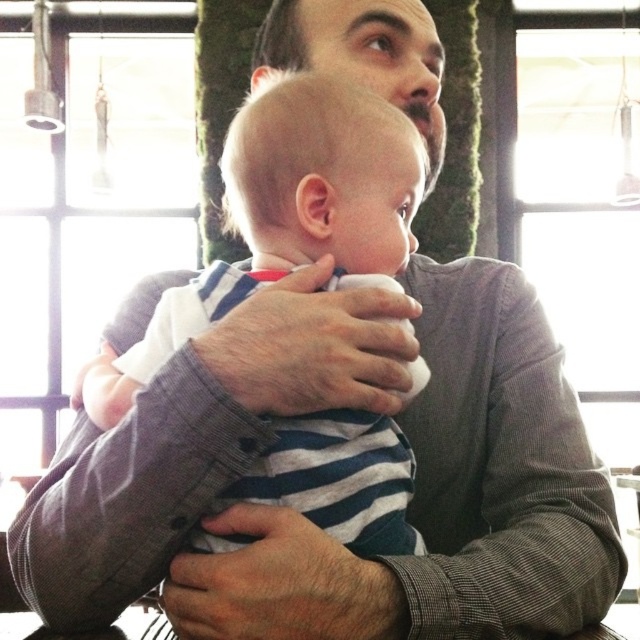
Question: Is gray checkered shirt at center below white striped shirt at center?

Choices:
 (A) no
 (B) yes

Answer: (B)

Question: Is gray checkered shirt at center positioned at the back of white striped shirt at center?

Choices:
 (A) yes
 (B) no

Answer: (B)

Question: Which of the following is the farthest from the observer?

Choices:
 (A) (376, 212)
 (B) (264, 387)

Answer: (A)

Question: Which object is closer to the camera taking this photo?

Choices:
 (A) gray checkered shirt at center
 (B) white striped shirt at center

Answer: (A)

Question: Is gray checkered shirt at center positioned in front of white striped shirt at center?

Choices:
 (A) yes
 (B) no

Answer: (A)